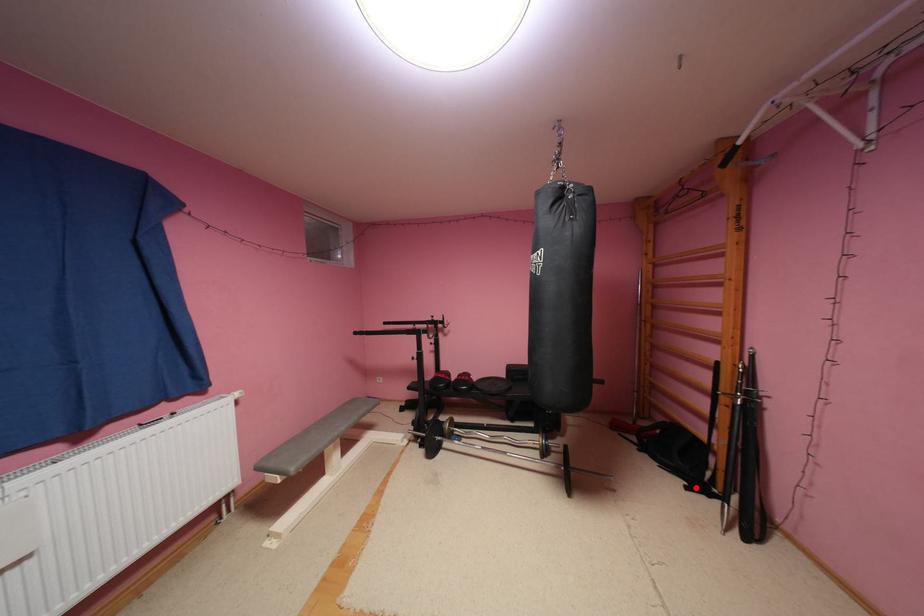
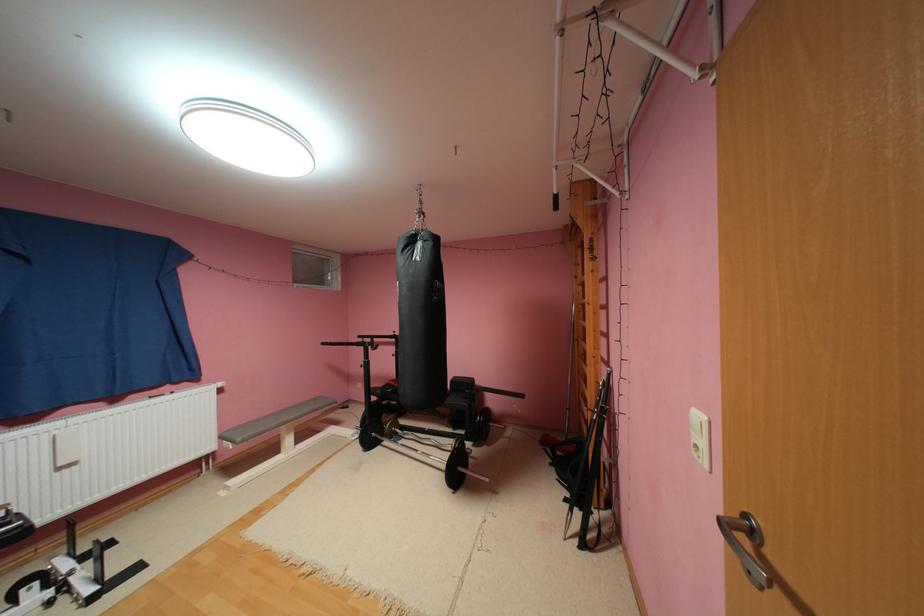
Question: A red point is marked in image1. In image2, is the corresponding 3D point closer to the camera or farther? Reply with the corresponding letter.

Choices:
 (A) The corresponding 3D point is closer.
 (B) The corresponding 3D point is farther.

Answer: (A)